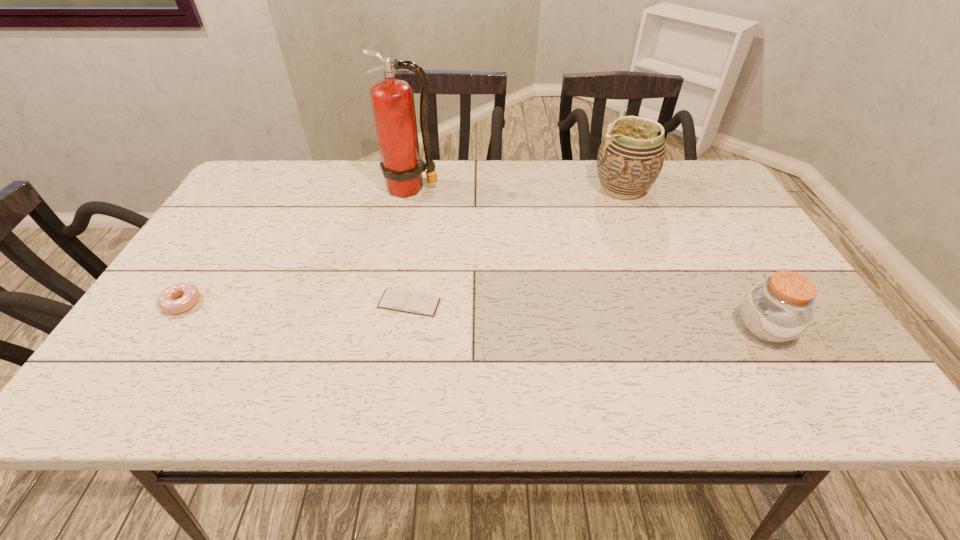
Where is `free space located 0.300m on the back of the rightmost object`? This screenshot has width=960, height=540. free space located 0.300m on the back of the rightmost object is located at coordinates (704, 224).

Identify the location of free space located on the right of the second shortest object. This screenshot has height=540, width=960. (227, 303).

Where is `vacant space situated 0.240m on the left of the diary`? This screenshot has height=540, width=960. vacant space situated 0.240m on the left of the diary is located at coordinates (273, 303).

You are a GUI agent. You are given a task and a screenshot of the screen. Output one action in this format:
    pyautogui.click(x=<x>, y=<y>)
    Task: Click on the fire extinguisher that is positioned at the far edge
    This screenshot has height=540, width=960.
    Given the screenshot: What is the action you would take?
    pyautogui.click(x=393, y=105)

You are a GUI agent. You are given a task and a screenshot of the screen. Output one action in this format:
    pyautogui.click(x=<x>, y=<y>)
    Task: Click on the pottery located in the far edge section of the desktop
    
    Given the screenshot: What is the action you would take?
    pyautogui.click(x=630, y=158)

You are a GUI agent. You are given a task and a screenshot of the screen. Output one action in this format:
    pyautogui.click(x=<x>, y=<y>)
    Task: Click on the object at the left edge
    This screenshot has height=540, width=960.
    Given the screenshot: What is the action you would take?
    pyautogui.click(x=166, y=301)

Locate an element on the screen. The image size is (960, 540). object that is at the right edge is located at coordinates (780, 309).

At what (x,y) coordinates should I click in order to perform the action: click on free space at the far edge of the desktop. Please return your answer as a coordinate pair (x, y). Image resolution: width=960 pixels, height=540 pixels. Looking at the image, I should click on coord(552,194).

Where is `free region at the near edge of the desktop`? The image size is (960, 540). free region at the near edge of the desktop is located at coordinates (693, 396).

Identify the location of vacant position at the left edge of the desktop. The image size is (960, 540). (204, 328).